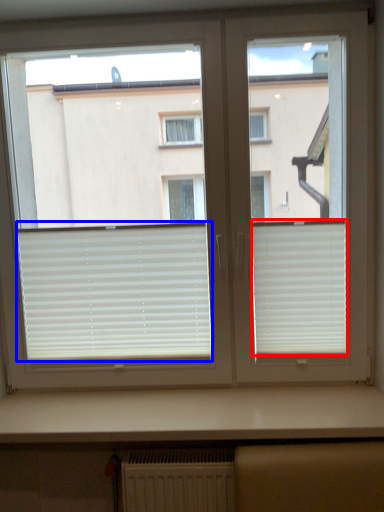
Question: Among these objects, which one is farthest to the camera, window blind (highlighted by a red box) or window blind (highlighted by a blue box)?

Choices:
 (A) window blind
 (B) window blind

Answer: (B)